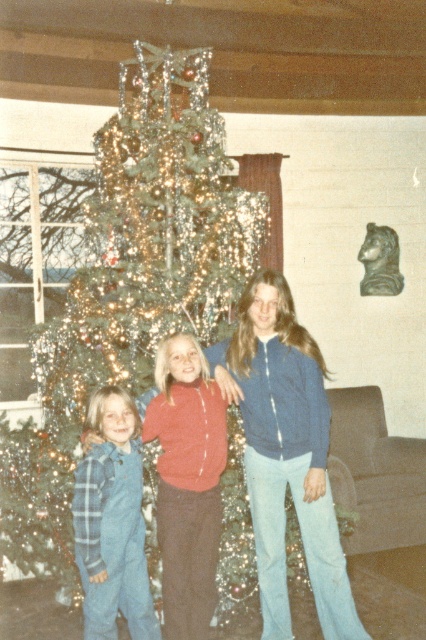
You are a photographer trying to capture a clear shot of the blue denim jacket at center and the blue corduroy pants at lower left. Since you want to focus on both items equally, which one might you need to adjust your camera settings for to ensure proper focus, considering their sizes?

The blue denim jacket at center is larger in size than the blue corduroy pants at lower left, so you might need to adjust your camera settings to focus on the larger blue denim jacket at center to ensure both are in proper focus.

You are standing in front of the Christmas tree and want to take a photo of the blue denim jacket at center. Which direction should you move to get a better shot?

The blue denim jacket at center is located at point (285, 452), so you should move towards the center of the image to capture it better.

Based on the scene description, where is the green shiny christmas tree at center located in terms of its 2D coordinates?

The green shiny christmas tree at center is located at the 2D coordinates of point (131,282).